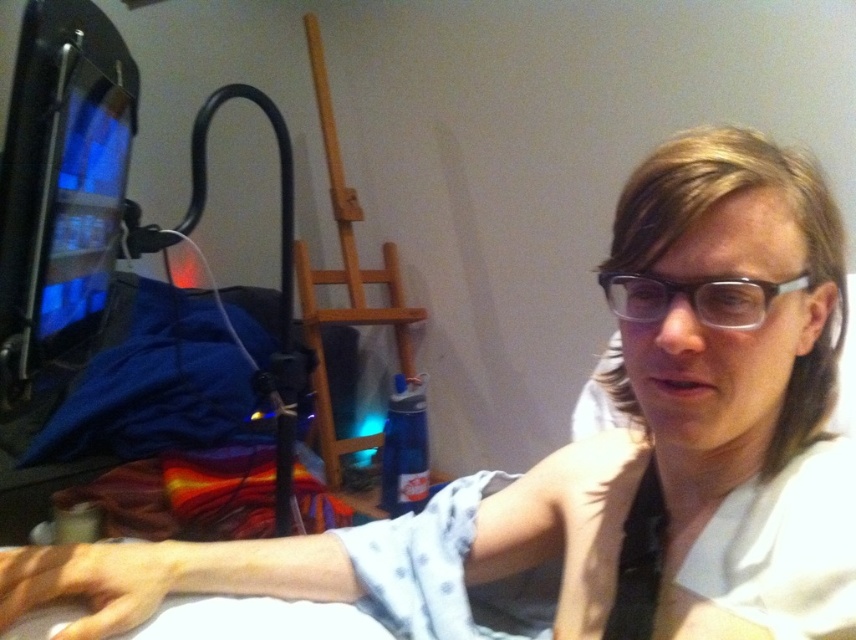
You are organizing items in the room and need to place the matte black monitor at left closer to the wall. Since the clear plastic glasses at center are in the way, can you move them to make space?

The matte black monitor at left is closer to you than the clear plastic glasses at center, so you can move the clear plastic glasses at center to make space for moving the matte black monitor at left closer to the wall.

In the scene shown: You are organizing items in the scene. The matte black monitor at left needs to be moved to the right side of the clear plastic glasses at center. Is this possible without overlapping them?

The matte black monitor at left is currently to the left of the clear plastic glasses at center. Moving it to the right side of the clear plastic glasses at center would require shifting it to the right, which is feasible as long as there is enough space available on the right side of the clear plastic glasses at center to accommodate the monitor without overlapping.

You are organizing a desk and need to place both the matte black monitor at left and the clear plastic glasses at center. Which object requires more desk space due to its size?

The matte black monitor at left requires more desk space because it is larger in size than the clear plastic glasses at center.